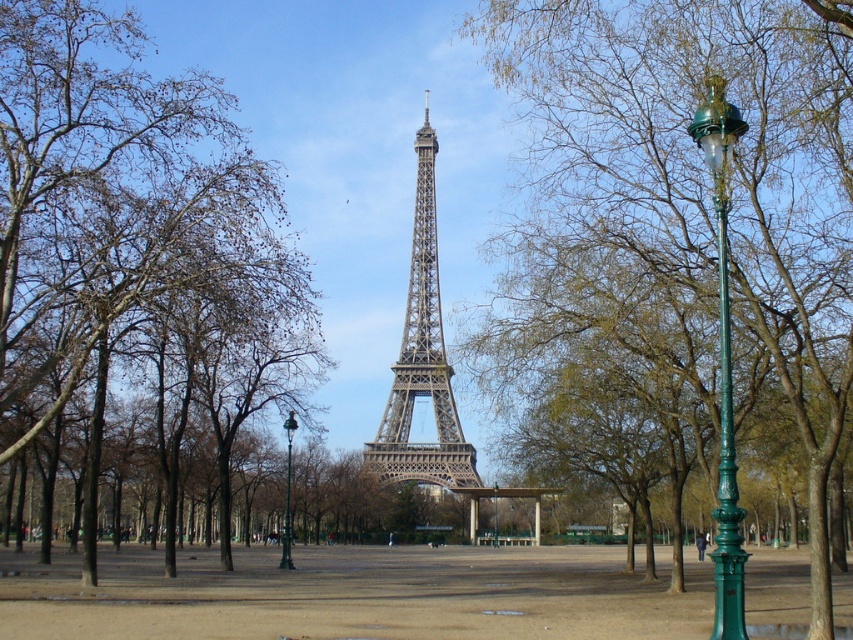
You are planning to take a photo of the metallic gray tower at center. There is a green leafy tree at center in the way. Can you tell me which one is wider so I can decide if I need to move the tree to get a clear shot of the tower?

The green leafy tree at center might be wider than metallic gray tower at center, so you may need to move the tree to ensure the tower is fully visible in your photo.

You are standing at the point marked as point (706, 173) in the park scene. Based on the description, what can you see immediately around you?

The point (706, 173) is on a green leafy tree at center, so you are surrounded by the branches and leaves of the tree.

You are a tourist standing in the park and want to take a photo of the metallic gray tower at center with the brown leafy tree at left in the background. Can you position yourself so that the tree is to the right of the tower in your photo?

The brown leafy tree at left is positioned on the left side of metallic gray tower at center. If you want the tree to appear to the right of the tower in your photo, you would need to position yourself to the left of the actual arrangement so that when you take the photo, the perspective shifts the tree to the right side of the tower. However, based on the given spatial description, the tree is already on the left of the tower, so positioning yourself normally would show the tree on the left. To have the 1